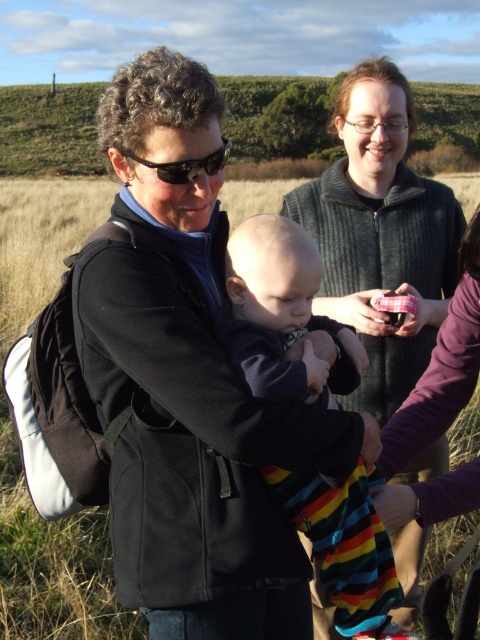
Between point (428, 307) and point (212, 154), which one is positioned behind?

Point (428, 307)

Is knitted sweater at upper center further to camera compared to black plastic sunglasses at center?

Yes, it is.

Does point (383, 340) come behind point (153, 166)?

Yes, it is.

You are a GUI agent. You are given a task and a screenshot of the screen. Output one action in this format:
    pyautogui.click(x=<x>, y=<y>)
    Task: Click on the knitted sweater at upper center
    The height and width of the screenshot is (640, 480).
    Given the screenshot: What is the action you would take?
    pyautogui.click(x=381, y=234)

Does striped cotton baby at center have a larger size compared to black plastic sunglasses at center?

Incorrect, striped cotton baby at center is not larger than black plastic sunglasses at center.

Is striped cotton baby at center shorter than black plastic sunglasses at center?

In fact, striped cotton baby at center may be taller than black plastic sunglasses at center.

Who is more forward, (354, 528) or (172, 168)?

Point (172, 168) is in front.

Image resolution: width=480 pixels, height=640 pixels. What are the coordinates of `striped cotton baby at center` in the screenshot? It's located at (279, 312).

Between knitted sweater at upper center and striped cotton baby at center, which one appears on the left side from the viewer's perspective?

From the viewer's perspective, striped cotton baby at center appears more on the left side.

Can you confirm if knitted sweater at upper center is positioned above striped cotton baby at center?

Indeed, knitted sweater at upper center is positioned over striped cotton baby at center.

Identify the location of knitted sweater at upper center. Image resolution: width=480 pixels, height=640 pixels. (381, 234).